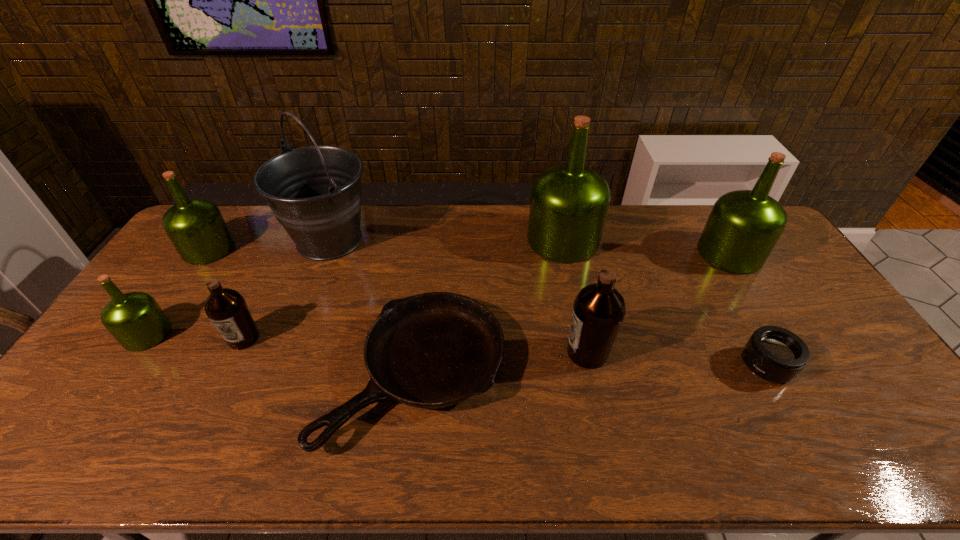
This screenshot has height=540, width=960. Identify the location of the second shortest object. (775, 354).

Find the location of a particular element. frying pan is located at coordinates coord(433,350).

Locate an element on the screen. black frying pan is located at coordinates (433, 350).

Identify the location of vacant space located 0.090m on the left of the bucket. Image resolution: width=960 pixels, height=540 pixels. (257, 240).

The image size is (960, 540). In order to click on free space located on the right of the biggest green olive oil in this screenshot , I will do `click(672, 240)`.

Identify the location of vacant space positioned on the back of the fifth shortest olive oil. (708, 218).

At what (x,y) coordinates should I click in order to perform the action: click on blank space located 0.100m on the right of the third biggest green olive oil. Please return your answer as a coordinate pair (x, y). The width and height of the screenshot is (960, 540). Looking at the image, I should click on (262, 249).

Find the location of a particular element. vacant region located 0.250m on the label of the right brown olive oil is located at coordinates (474, 353).

You are a GUI agent. You are given a task and a screenshot of the screen. Output one action in this format:
    pyautogui.click(x=<x>, y=<y>)
    Task: Click on the free space located 0.170m on the label of the right brown olive oil
    This screenshot has height=540, width=960.
    Given the screenshot: What is the action you would take?
    pyautogui.click(x=503, y=353)

Where is `free space located on the label of the right brown olive oil`? This screenshot has height=540, width=960. free space located on the label of the right brown olive oil is located at coordinates (427, 353).